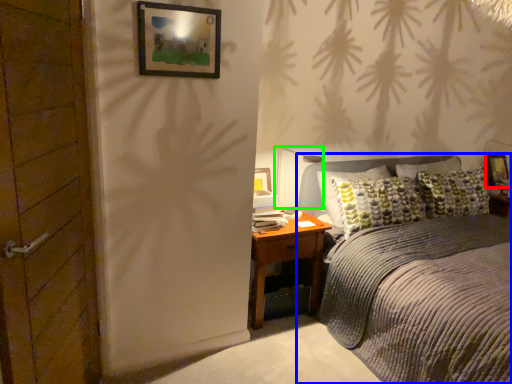
Question: Which object is positioned farthest from picture frame (highlighted by a red box)? Select from bed (highlighted by a blue box) and light fixture (highlighted by a green box).

Choices:
 (A) bed
 (B) light fixture

Answer: (A)